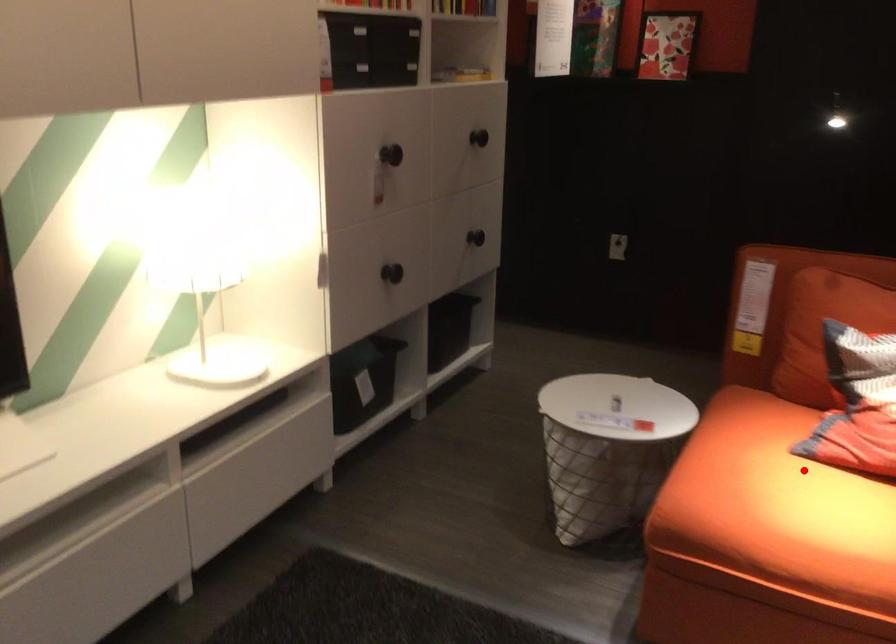
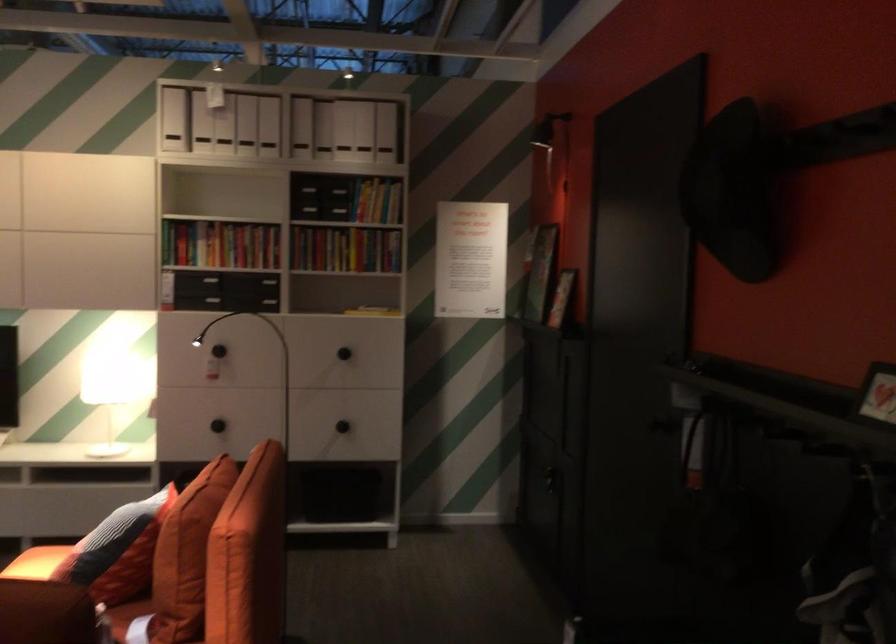
Where in the second image is the point corresponding to the highlighted location from the first image?

(36, 563)